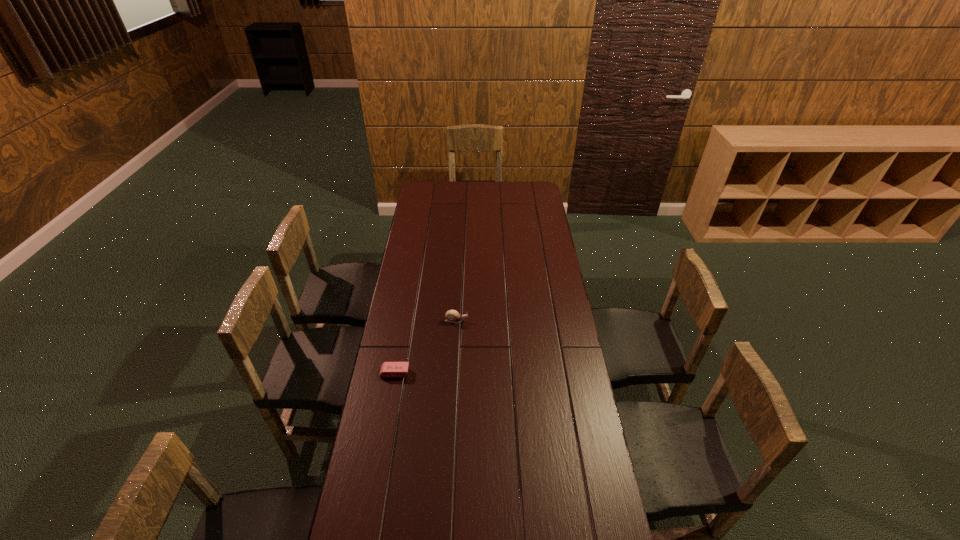
Where is `vacant region at the far left corner`? This screenshot has height=540, width=960. vacant region at the far left corner is located at coordinates (430, 194).

Identify the location of free space at the far right corner of the desktop. (522, 188).

You are a GUI agent. You are given a task and a screenshot of the screen. Output one action in this format:
    pyautogui.click(x=<x>, y=<y>)
    Task: Click on the vacant space that satisfies the following two spatial constraints: 1. on the front-facing side of the farther object; 2. on the front side of the nearer object
    
    Given the screenshot: What is the action you would take?
    pyautogui.click(x=453, y=373)

Identify the location of free spot that satisfies the following two spatial constraints: 1. on the front-facing side of the escargot; 2. on the front side of the eraser. The height and width of the screenshot is (540, 960). (453, 373).

This screenshot has height=540, width=960. I want to click on blank area in the image that satisfies the following two spatial constraints: 1. on the front-facing side of the right object; 2. on the front side of the nearer object, so click(453, 373).